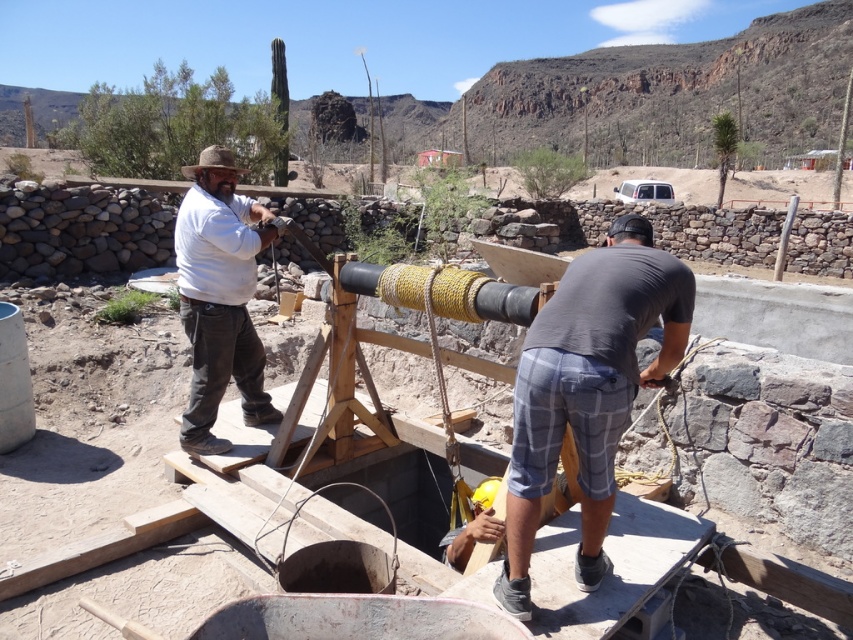
Who is positioned more to the left, gray plaid shorts at center or wooden frame at center?

wooden frame at center is more to the left.

Where is `gray plaid shorts at center`? This screenshot has height=640, width=853. gray plaid shorts at center is located at coordinates (587, 388).

Is gray plaid shorts at center bigger than matte white shirt at center?

Actually, gray plaid shorts at center might be smaller than matte white shirt at center.

This screenshot has width=853, height=640. I want to click on gray plaid shorts at center, so click(587, 388).

Is wooden frame at center to the right of matte white shirt at center from the viewer's perspective?

Correct, you'll find wooden frame at center to the right of matte white shirt at center.

Describe the element at coordinates (401, 496) in the screenshot. I see `wooden frame at center` at that location.

Where is `wooden frame at center`? The height and width of the screenshot is (640, 853). wooden frame at center is located at coordinates (401, 496).